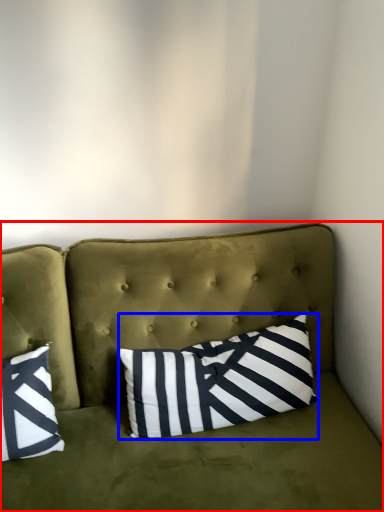
Question: Which object appears farthest to the camera in this image, studio couch (highlighted by a red box) or pillow (highlighted by a blue box)?

Choices:
 (A) studio couch
 (B) pillow

Answer: (B)